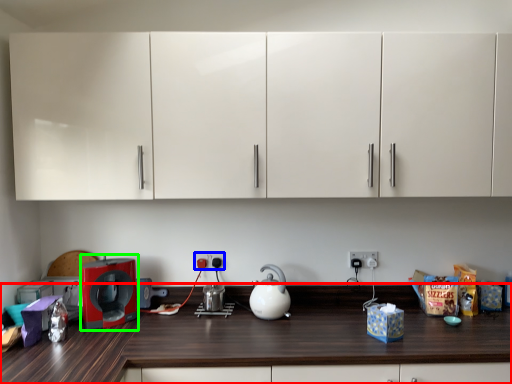
Question: Which object is the closest to the countertop (highlighted by a red box)? Choose among these: electric outlet (highlighted by a blue box) or home appliance (highlighted by a green box).

Choices:
 (A) electric outlet
 (B) home appliance

Answer: (B)